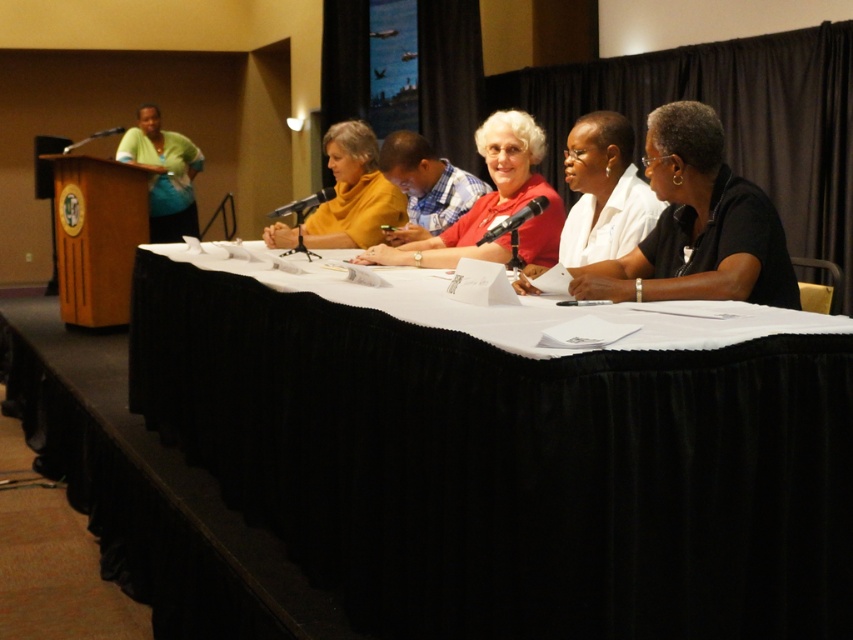
Looking at this image, you are a photographer positioned behind the white fabric table at center and the plaid shirt at center. Which object is closer to you?

The white fabric table at center is closer to you since it is in front of the plaid shirt at center.

You are a photographer trying to capture a clear shot of both the plaid shirt at center and the matte green blouse at left. Since you want to ensure both are fully visible in the frame, which one might require you to adjust your camera angle to avoid cropping?

The plaid shirt at center is shorter than the matte green blouse at left, so you might need to adjust your camera angle to ensure the taller matte green blouse at left is fully visible without cropping.

You are sitting at the back of the room and want to hand a document to both the plaid shirt at center and the matte green blouse at left. Which person should you approach first to ensure you can reach them without walking past the other?

You should approach the plaid shirt at center first because it is closer to the viewer than the matte green blouse at left, so you can reach them without needing to walk past the other person.